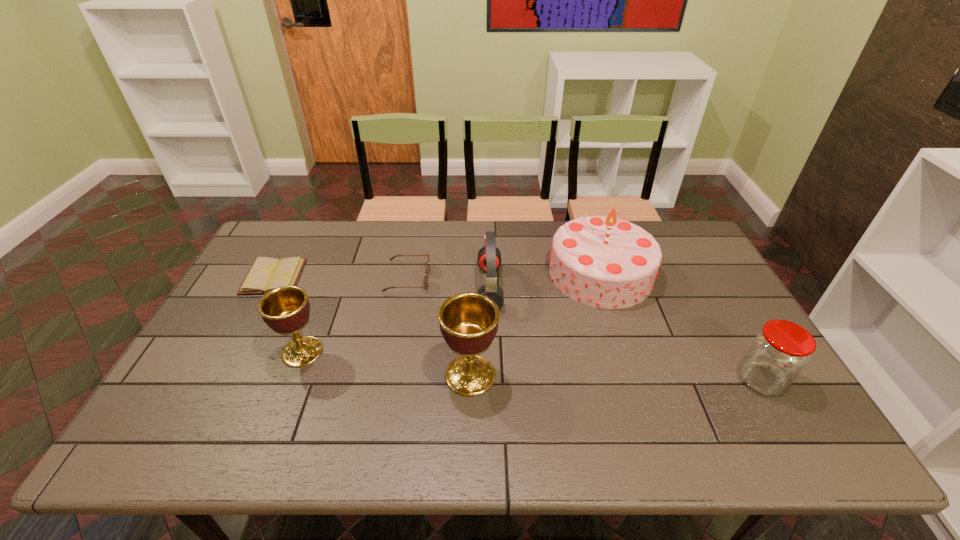
The chalices are evenly distributed in the image. To maintain this, where would you place another chalice on the right? Please point to a free space. Please provide its 2D coordinates. Your answer should be formatted as a tuple, i.e. [(x, y)], where the tuple contains the x and y coordinates of a point satisfying the conditions above.

[(656, 401)]